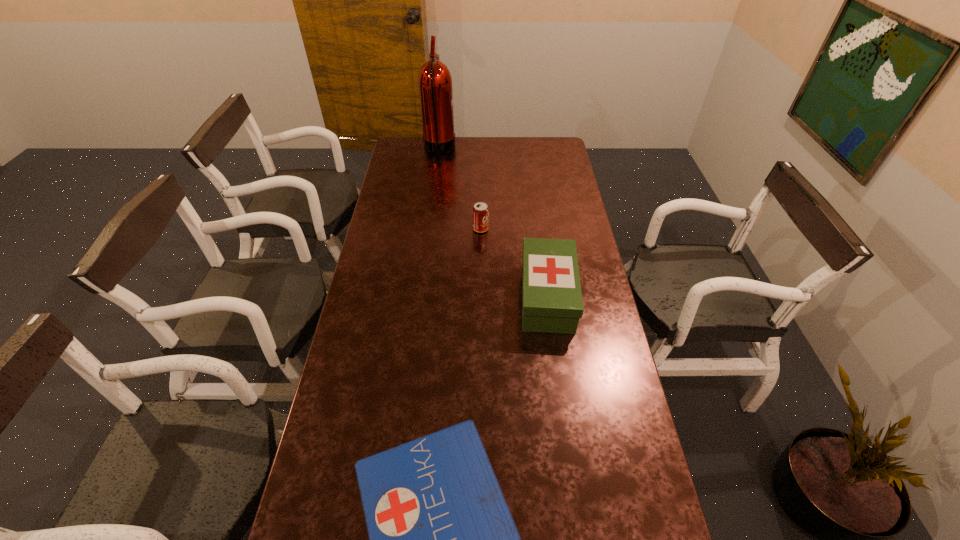
The width and height of the screenshot is (960, 540). What are the coordinates of `object that is at the right edge` in the screenshot? It's located at 552,302.

Locate an element on the screen. The width and height of the screenshot is (960, 540). object present at the far left corner is located at coordinates (435, 86).

In the image, there is a desktop. Identify the location of free space at the far edge. (504, 144).

Image resolution: width=960 pixels, height=540 pixels. In the image, there is a desktop. Identify the location of vacant space at the left edge. (397, 228).

You are a GUI agent. You are given a task and a screenshot of the screen. Output one action in this format:
    pyautogui.click(x=<x>, y=<y>)
    Task: Click on the free space at the right edge of the desktop
    This screenshot has width=960, height=540.
    Given the screenshot: What is the action you would take?
    pyautogui.click(x=587, y=347)

Where is `blank region between the third farthest object and the farthest object`? This screenshot has width=960, height=540. blank region between the third farthest object and the farthest object is located at coordinates (493, 223).

Locate an element on the screen. Image resolution: width=960 pixels, height=540 pixels. vacant point located between the farthest object and the right first-aid kit is located at coordinates (493, 223).

Where is `vacant space in between the right first-aid kit and the tallest object`? The image size is (960, 540). vacant space in between the right first-aid kit and the tallest object is located at coordinates (493, 223).

Identify which object is the second closest to the farther first-aid kit. Please provide its 2D coordinates. Your answer should be formatted as a tuple, i.e. [(x, y)], where the tuple contains the x and y coordinates of a point satisfying the conditions above.

[(442, 539)]

In order to click on the closest object to the shorter first-aid kit in this screenshot , I will do `click(552, 302)`.